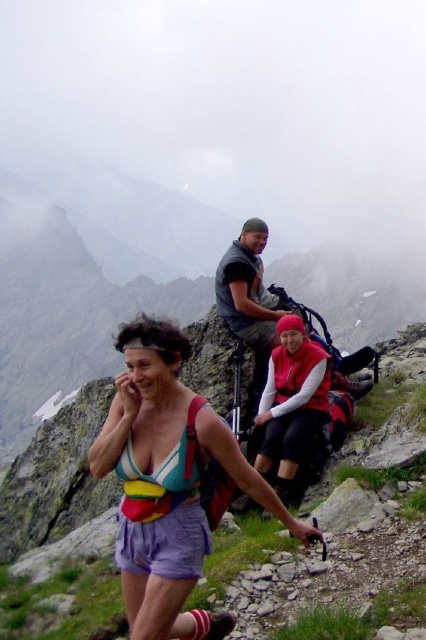
You are a photographer trying to capture a photo of the red fleece vest at center and the multicolored fabric bikini top at center. Since you want both subjects in the frame, which direction should you move your camera to the left or right to ensure both are visible?

The red fleece vest at center is to the right of multicolored fabric bikini top at center. To include both in the frame, move your camera to the left so that the multicolored fabric bikini top at center comes into view first, then adjust to the right to include the red fleece vest at center.

Consider the image. You are a hiker planning to carry both the rainbow fabric fanny pack at center and the red fleece vest at center. Which item has a greater width?

The rainbow fabric fanny pack at center has a greater width than the red fleece vest at center.

Based on the photo, you are a photographer trying to capture the rainbow fabric fanny pack at center and the multicolored fabric bikini top at center in the same frame. Based on their positions, which one should you focus on first to ensure both are in the shot?

The rainbow fabric fanny pack at center is below the multicolored fabric bikini top at center, so you should focus on the multicolored fabric bikini top at center first to ensure both are in the frame.